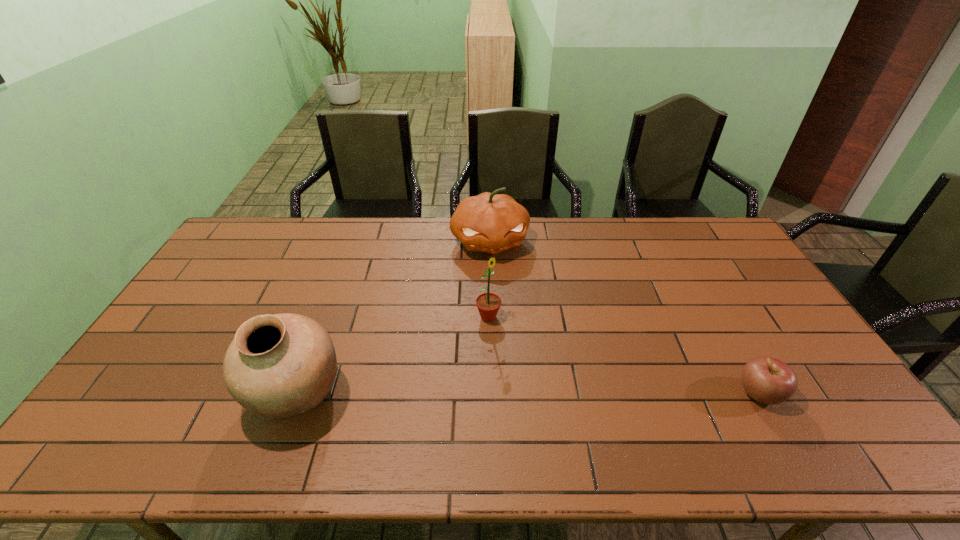
Find the location of a particular element. This screenshot has width=960, height=540. free area in between the shortest object and the leftmost object is located at coordinates (528, 393).

Where is `free spot between the pumpkin and the rightmost object`? free spot between the pumpkin and the rightmost object is located at coordinates (625, 317).

The height and width of the screenshot is (540, 960). Identify the location of object that is the third closest to the third nearest object. (767, 380).

The image size is (960, 540). In order to click on object that ranks as the second closest to the leftmost object in this screenshot , I will do `click(489, 222)`.

Locate an element on the screen. The image size is (960, 540). vacant space that satisfies the following two spatial constraints: 1. on the front side of the farthest object; 2. on the side of the rightmost object with the unique marking is located at coordinates (494, 393).

This screenshot has width=960, height=540. Identify the location of free space in the image that satisfies the following two spatial constraints: 1. on the back side of the leftmost object; 2. on the side of the rightmost object with the unique marking. (297, 393).

Find the location of `vacant space that satisfies the following two spatial constraints: 1. on the back side of the leftmost object; 2. on the side of the rightmost object with the unique marking`. vacant space that satisfies the following two spatial constraints: 1. on the back side of the leftmost object; 2. on the side of the rightmost object with the unique marking is located at coordinates (297, 393).

Where is `vacant area that satisfies the following two spatial constraints: 1. on the back side of the leftmost object; 2. on the side of the shortest object with the unique marking`? Image resolution: width=960 pixels, height=540 pixels. vacant area that satisfies the following two spatial constraints: 1. on the back side of the leftmost object; 2. on the side of the shortest object with the unique marking is located at coordinates (297, 393).

You are a GUI agent. You are given a task and a screenshot of the screen. Output one action in this format:
    pyautogui.click(x=<x>, y=<y>)
    Task: Click on the vacant space that satisfies the following two spatial constraints: 1. on the front side of the second farthest object; 2. on the side of the shortest object with the unique marking
    The width and height of the screenshot is (960, 540).
    Given the screenshot: What is the action you would take?
    pyautogui.click(x=490, y=393)

At what (x,y) coordinates should I click in order to perform the action: click on vacant space that satisfies the following two spatial constraints: 1. on the front side of the farthest object; 2. on the side of the shortest object with the unique marking. Please return your answer as a coordinate pair (x, y). Looking at the image, I should click on (494, 393).